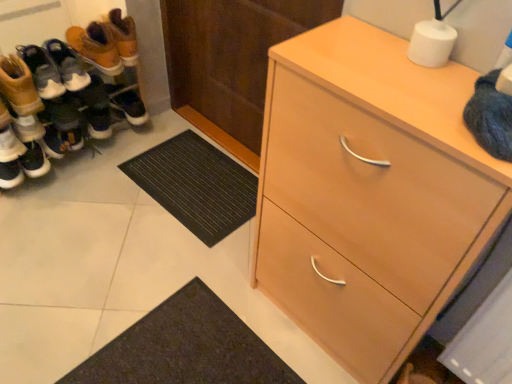
Question: From a real-world perspective, is wooden door at center physically above light wood cabinet at right?

Choices:
 (A) no
 (B) yes

Answer: (A)

Question: Can you confirm if wooden door at center is taller than light wood cabinet at right?

Choices:
 (A) no
 (B) yes

Answer: (A)

Question: Is wooden door at center closer to the viewer compared to light wood cabinet at right?

Choices:
 (A) no
 (B) yes

Answer: (A)

Question: Does wooden door at center have a smaller size compared to light wood cabinet at right?

Choices:
 (A) yes
 (B) no

Answer: (A)

Question: Is wooden door at center behind light wood cabinet at right?

Choices:
 (A) no
 (B) yes

Answer: (B)

Question: Is wooden door at center far away from light wood cabinet at right?

Choices:
 (A) no
 (B) yes

Answer: (A)

Question: Can you confirm if leather boots at left, the second footwear viewed from the front, is smaller than matte black shoes at left, the first footwear in the back-to-front sequence?

Choices:
 (A) yes
 (B) no

Answer: (B)

Question: Can you confirm if leather boots at left, the second footwear viewed from the front, is thinner than matte black shoes at left, the fourth footwear in the front-to-back sequence?

Choices:
 (A) yes
 (B) no

Answer: (A)

Question: Does leather boots at left, the second footwear viewed from the front, have a greater height compared to matte black shoes at left, the fourth footwear in the front-to-back sequence?

Choices:
 (A) no
 (B) yes

Answer: (B)

Question: From a real-world perspective, is leather boots at left, the third footwear when ordered from back to front, under matte black shoes at left, the fourth footwear in the front-to-back sequence?

Choices:
 (A) yes
 (B) no

Answer: (A)

Question: Is leather boots at left, the third footwear when ordered from back to front, bigger than matte black shoes at left, the first footwear in the back-to-front sequence?

Choices:
 (A) yes
 (B) no

Answer: (A)

Question: From the image's perspective, does leather boots at left, the third footwear when ordered from back to front, appear lower than matte black shoes at left, the first footwear in the back-to-front sequence?

Choices:
 (A) no
 (B) yes

Answer: (B)

Question: Considering the relative sizes of wooden door at center and black rubber doormat at lower center in the image provided, is wooden door at center bigger than black rubber doormat at lower center?

Choices:
 (A) no
 (B) yes

Answer: (B)